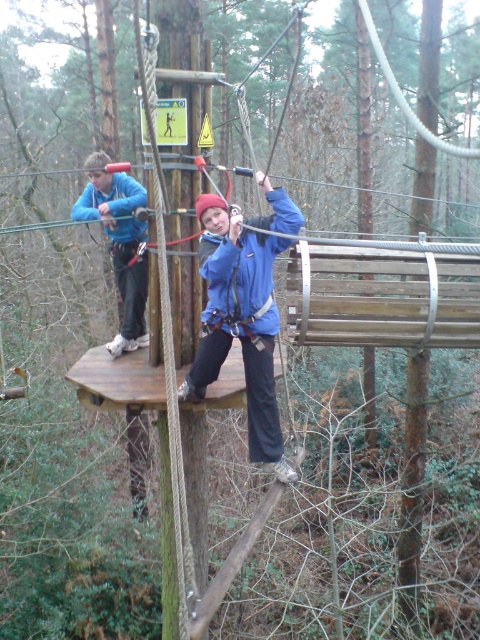
Question: Which point is farther from the camera taking this photo?

Choices:
 (A) (123, 300)
 (B) (256, 340)

Answer: (A)

Question: In this image, where is blue fabric jacket at center located relative to matte blue jacket at center?

Choices:
 (A) left
 (B) right

Answer: (B)

Question: Among these points, which one is nearest to the camera?

Choices:
 (A) (109, 196)
 (B) (224, 294)

Answer: (B)

Question: Where is blue fabric jacket at center located in relation to matte blue jacket at center in the image?

Choices:
 (A) below
 (B) above

Answer: (A)

Question: Which point appears farthest from the camera in this image?

Choices:
 (A) (227, 340)
 (B) (134, 269)

Answer: (B)

Question: Does blue fabric jacket at center have a greater width compared to matte blue jacket at center?

Choices:
 (A) yes
 (B) no

Answer: (A)